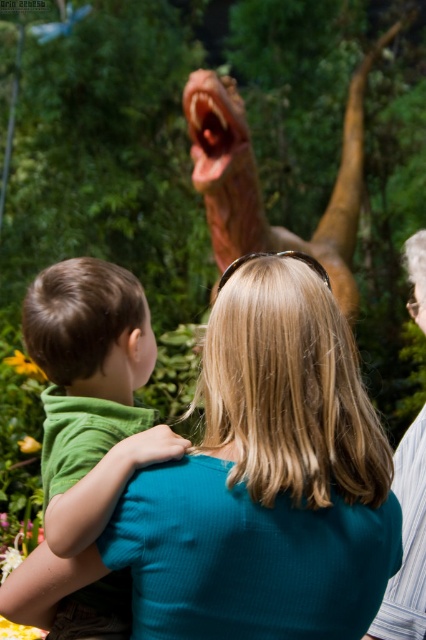
You are standing behind two people observing a dinosaur model. The teal ribbed shirt at center and the striped fabric shirt at right are both visible. Which person is closer to you?

The teal ribbed shirt at center is closer to you because it is in front of the striped fabric shirt at right.

You are a photographer trying to capture a clear shot of the teal ribbed shirt at center. Based on its position at point coordinates, where should you aim your camera?

The teal ribbed shirt at center is located at coordinates point (265, 480), so aim your camera at that position to capture it clearly.

You are a photographer trying to capture a group photo of the green matte shirt at upper left and striped fabric shirt at right. Given their sizes, which one should you position closer to the camera to make them appear the same size in the photo?

The green matte shirt at upper left is smaller than the striped fabric shirt at right, so you should position the green matte shirt at upper left closer to the camera to make them appear the same size in the photo.